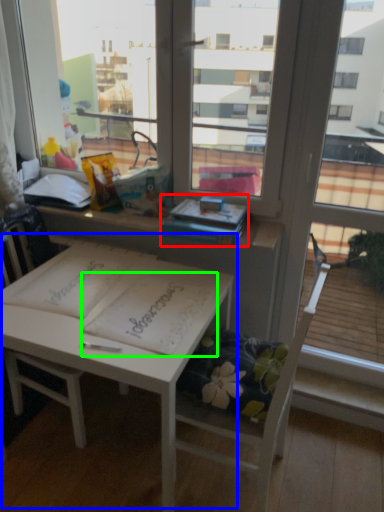
Question: Which object is positioned farthest from book (highlighted by a red box)? Select from table (highlighted by a blue box) and notebook (highlighted by a green box).

Choices:
 (A) table
 (B) notebook

Answer: (A)